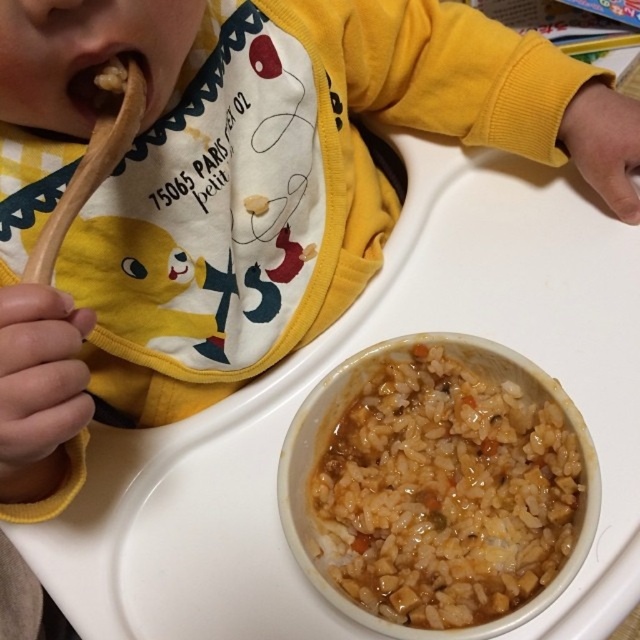
Which is above, brown matte rice at center or wooden spoon at upper left?

wooden spoon at upper left

Is brown matte rice at center below wooden spoon at upper left?

Yes.

The image size is (640, 640). I want to click on brown matte rice at center, so click(444, 492).

Identify the location of wooden spoon at upper left. pyautogui.click(x=90, y=173).

From the picture: Does wooden spoon at upper left come in front of brown matte food at mouth left?

That is True.

The height and width of the screenshot is (640, 640). What do you see at coordinates (90, 173) in the screenshot?
I see `wooden spoon at upper left` at bounding box center [90, 173].

In order to click on wooden spoon at upper left in this screenshot , I will do `click(90, 173)`.

Between point (456, 518) and point (120, 104), which one is positioned behind?

Point (456, 518)

Can you confirm if brown matte rice at center is positioned to the right of brown matte food at mouth left?

Indeed, brown matte rice at center is positioned on the right side of brown matte food at mouth left.

What do you see at coordinates (444, 492) in the screenshot?
I see `brown matte rice at center` at bounding box center [444, 492].

Identify the location of brown matte rice at center. The image size is (640, 640). (444, 492).